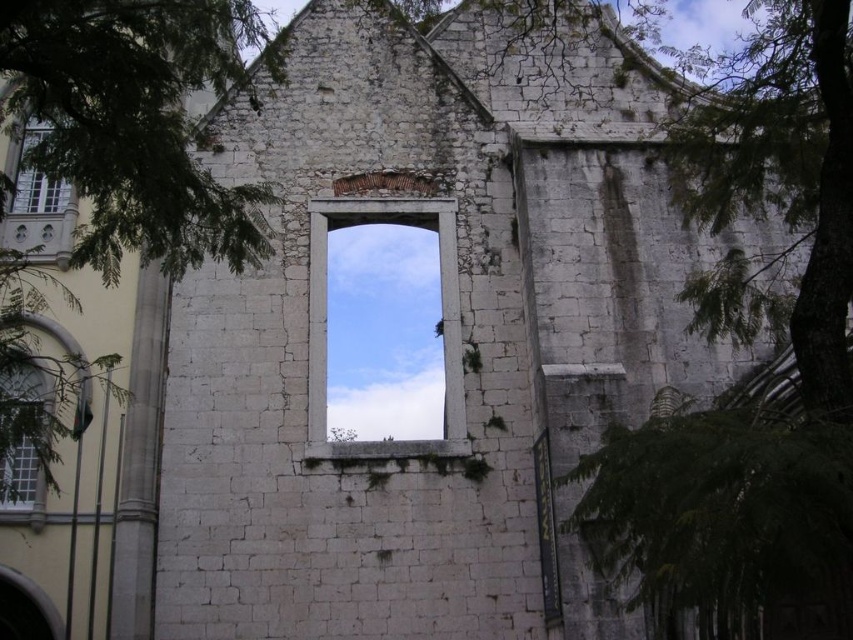
Question: Which point appears closest to the camera in this image?

Choices:
 (A) (20, 148)
 (B) (10, 401)
 (C) (844, 275)
 (D) (393, 208)

Answer: (C)

Question: Considering the real-world distances, which object is farthest from the green leafy tree at upper left?

Choices:
 (A) green leafy tree at right
 (B) matte glass window at upper left

Answer: (A)

Question: Based on their relative distances, which object is nearer to the green leafy tree at upper left?

Choices:
 (A) green leafy tree at right
 (B) clear glass window at lower left

Answer: (B)

Question: Can you confirm if green leafy tree at right is thinner than matte glass window at upper left?

Choices:
 (A) no
 (B) yes

Answer: (A)

Question: Can you confirm if green leafy tree at upper left is bigger than white stone window at center?

Choices:
 (A) yes
 (B) no

Answer: (A)

Question: Does green leafy tree at upper left appear under green leafy tree at right?

Choices:
 (A) no
 (B) yes

Answer: (B)